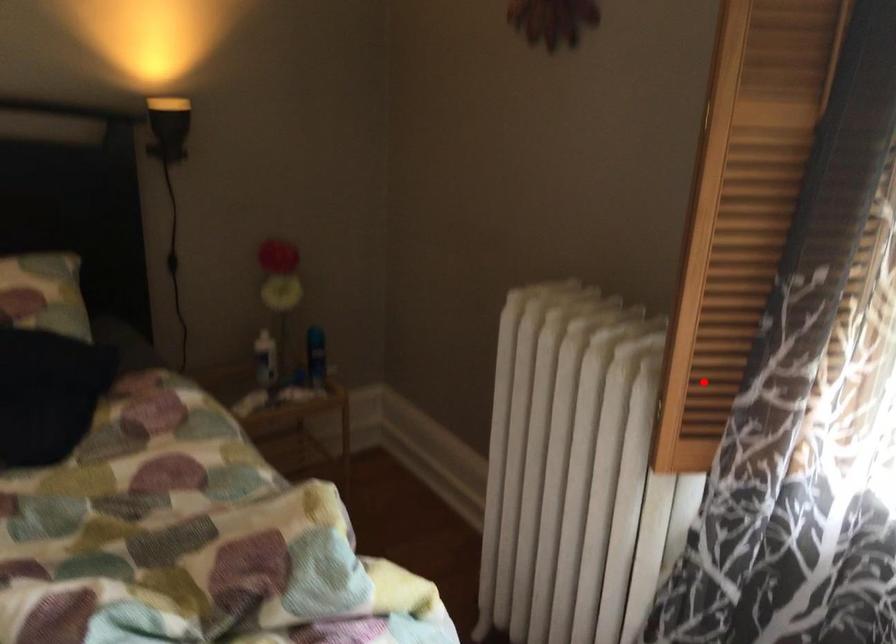
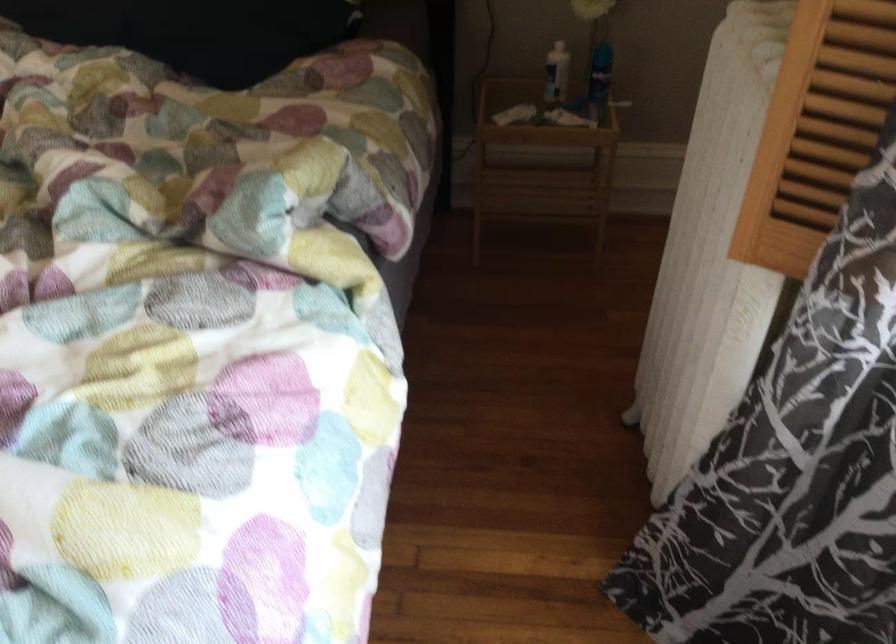
Question: I am providing you with two images of the same scene from different viewpoints. Given a red point in image1, look at the same physical point in image2. Is it:

Choices:
 (A) Closer to the viewpoint
 (B) Farther from the viewpoint

Answer: (A)